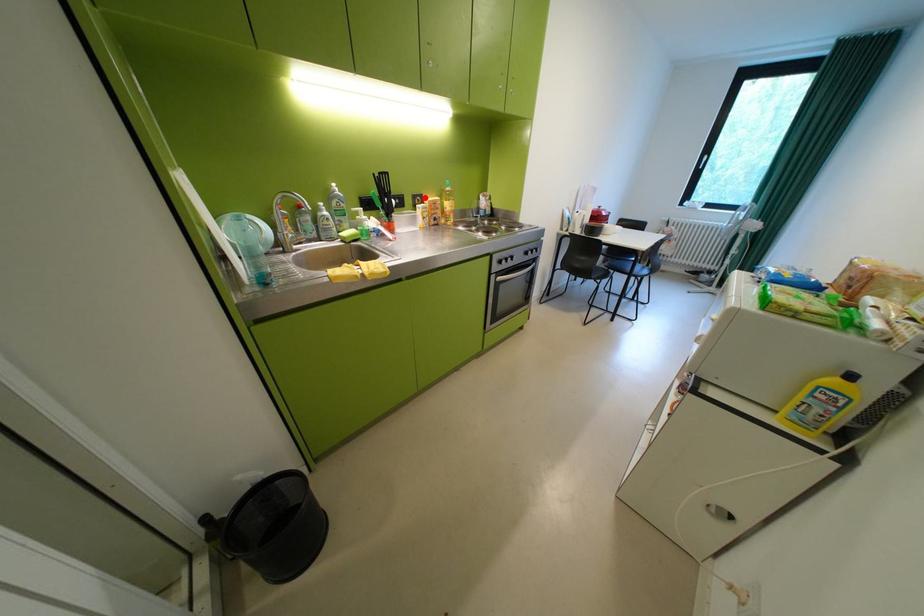
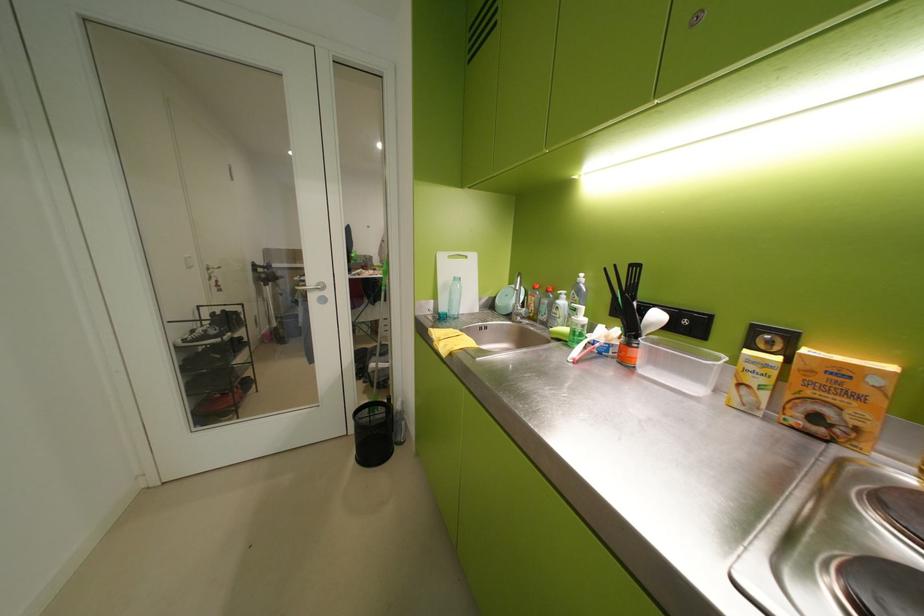
Question: I am providing you with two images of the same scene from different viewpoints. A red point is shown in image1. For the corresponding object point in image2, is it positioned nearer or farther from the camera?

Choices:
 (A) Nearer
 (B) Farther

Answer: (B)